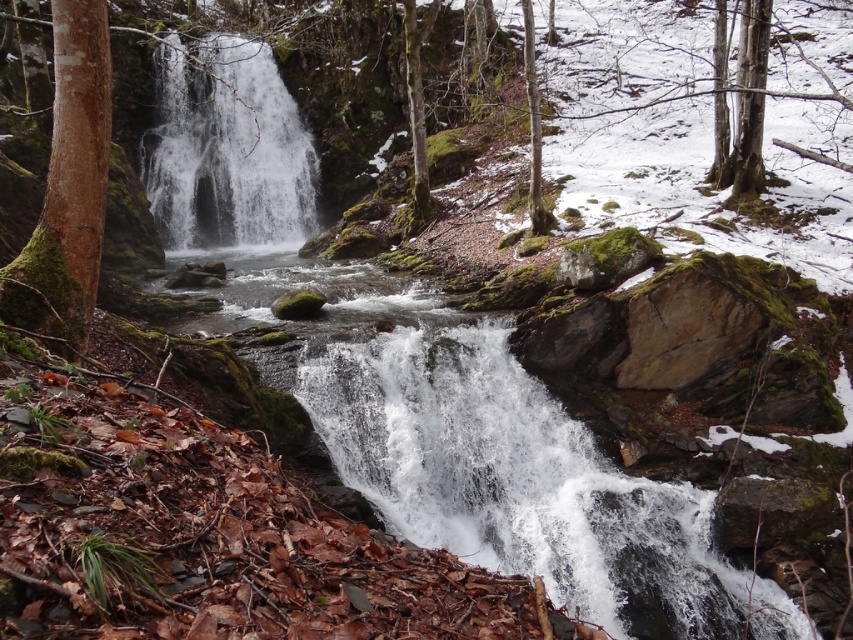
Which is more to the left, white frothy water at center or green mossy bark tree at left?

Positioned to the left is white frothy water at center.

Find the location of a particular element. This screenshot has width=853, height=640. white frothy water at center is located at coordinates (486, 452).

Consider the image. Between white frothy water at center and white frothy water at upper center, which one appears on the left side from the viewer's perspective?

white frothy water at upper center is more to the left.

Does white frothy water at center appear on the right side of white frothy water at upper center?

Indeed, white frothy water at center is positioned on the right side of white frothy water at upper center.

Measure the distance between point (345, 312) and camera.

Point (345, 312) is 13.60 meters from camera.

The height and width of the screenshot is (640, 853). In order to click on white frothy water at center in this screenshot , I will do `click(486, 452)`.

Does white frothy water at upper center appear under green mossy bark tree at left?

Actually, white frothy water at upper center is above green mossy bark tree at left.

Which is below, white frothy water at upper center or green mossy bark tree at left?

green mossy bark tree at left

Is point (178, 225) behind point (64, 179)?

Yes, it is behind point (64, 179).

The width and height of the screenshot is (853, 640). I want to click on white frothy water at upper center, so click(x=228, y=150).